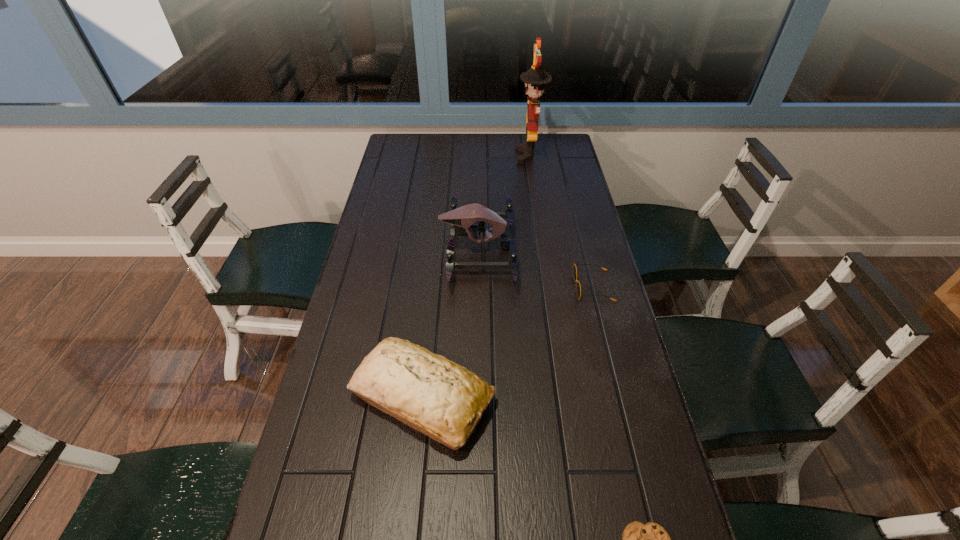
Find the location of a particular element. free point between the bread and the farthest object is located at coordinates (476, 276).

Identify the location of object that stands as the second closest to the sunglasses. (445, 401).

Image resolution: width=960 pixels, height=540 pixels. I want to click on object that is the fourth closest one to the bread, so click(535, 78).

The image size is (960, 540). Identify the location of free space that satisfies the following two spatial constraints: 1. on the front-facing side of the second shortest object; 2. on the front side of the second nearest object. (620, 398).